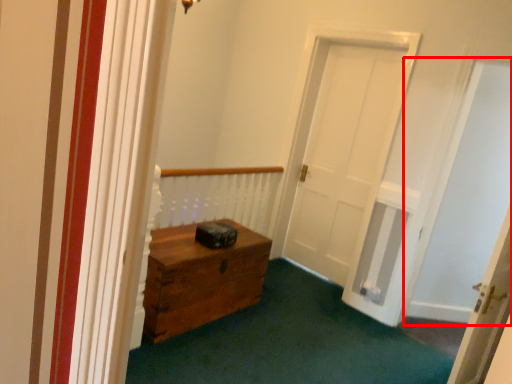
Question: From the image's perspective, where is passage (annotated by the red box) located relative to door?

Choices:
 (A) above
 (B) below

Answer: (A)